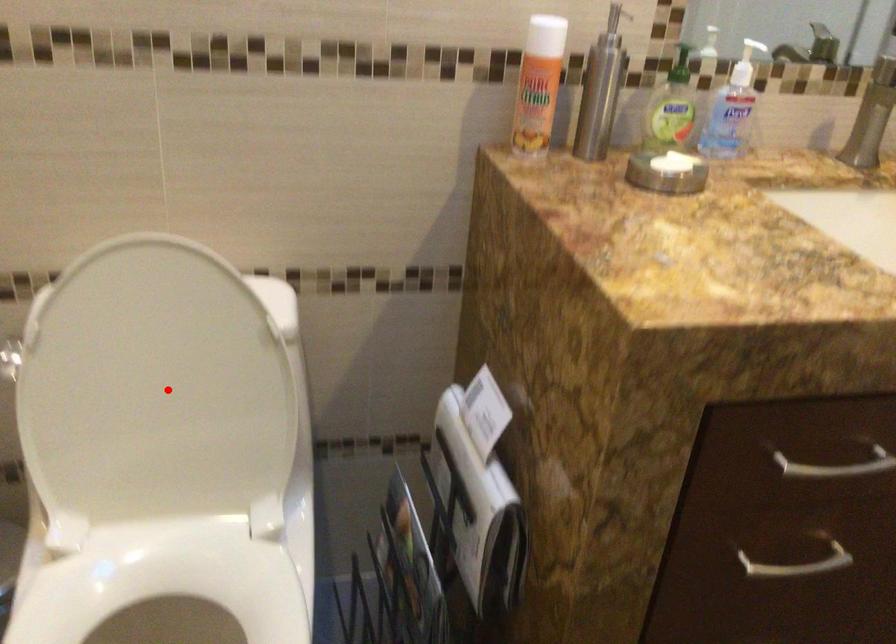
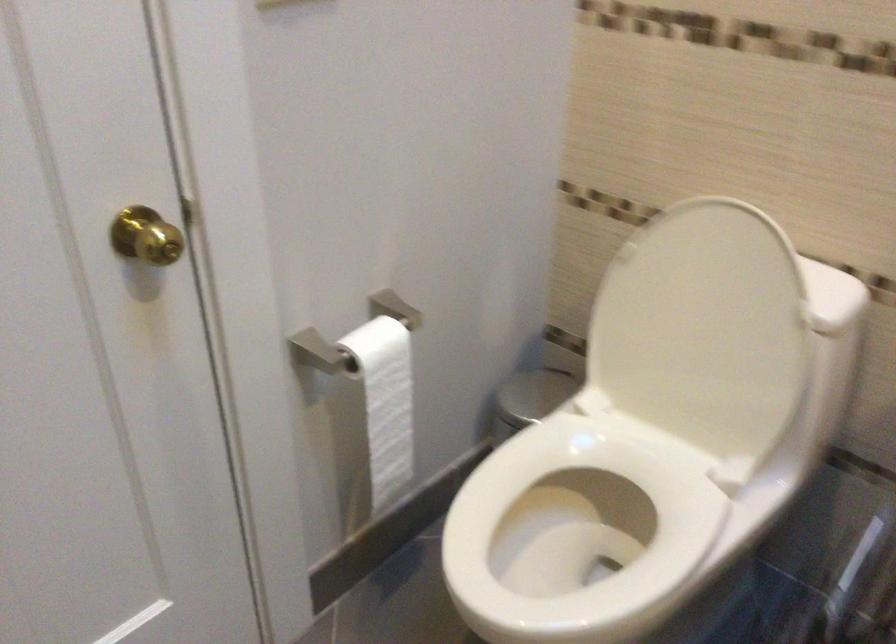
The point at the highlighted location is marked in the first image. Where is the corresponding point in the second image?

(702, 330)